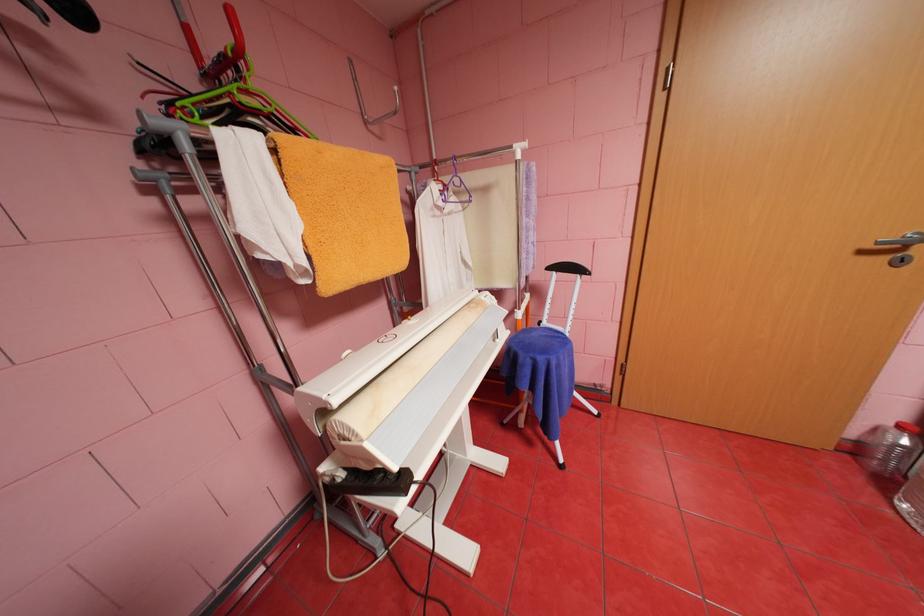
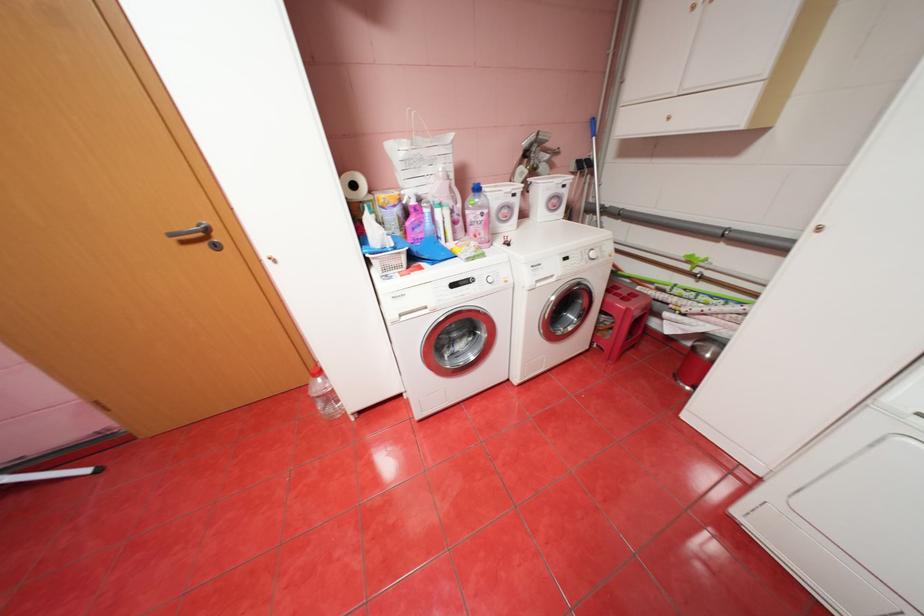
The point at (893,257) is marked in the first image. Where is the corresponding point in the second image?

(213, 245)